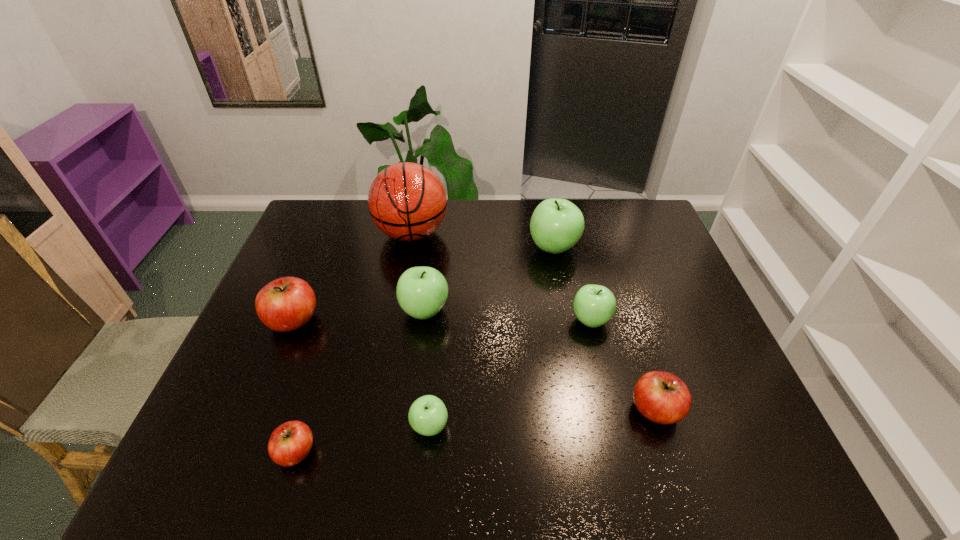
Find the location of a particular element. apple that is at the far edge is located at coordinates (556, 225).

Where is `object positioned at the left edge`? The width and height of the screenshot is (960, 540). object positioned at the left edge is located at coordinates (285, 304).

Find the location of a particular element. vacant space at the far edge of the desktop is located at coordinates (366, 239).

Image resolution: width=960 pixels, height=540 pixels. In the image, there is a desktop. What are the coordinates of `vacant space at the near edge` in the screenshot? It's located at (354, 467).

The image size is (960, 540). In order to click on vacant space at the left edge in this screenshot , I will do `click(269, 409)`.

The height and width of the screenshot is (540, 960). Find the location of `vacant space at the right edge`. vacant space at the right edge is located at coordinates (648, 240).

In the image, there is a desktop. At what (x,y) coordinates should I click in order to perform the action: click on vacant space at the far left corner. Please return your answer as a coordinate pair (x, y). The height and width of the screenshot is (540, 960). Looking at the image, I should click on (352, 199).

I want to click on free space at the far right corner of the desktop, so click(618, 204).

Find the location of a particular element. vacant point located between the second biggest green apple and the farthest apple is located at coordinates (490, 279).

Identify the location of unoccupied area between the second smallest green apple and the second biggest green apple. Image resolution: width=960 pixels, height=540 pixels. (508, 315).